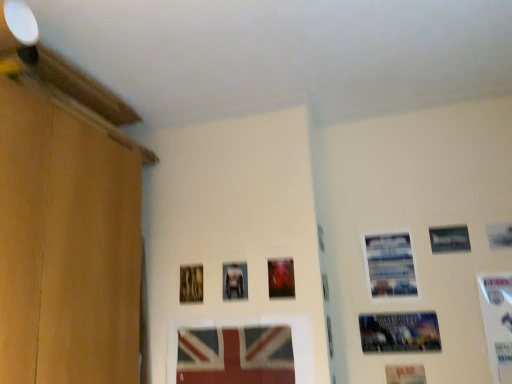
Question: Is metallic silver picture frame at upper right, the 3th picture frame in the right-to-left sequence, outside matte plastic picture frame at center, which is the 2th picture frame in left-to-right order?

Choices:
 (A) no
 (B) yes

Answer: (B)

Question: Considering the relative sizes of metallic silver picture frame at upper right, the 7th picture frame from the left, and matte plastic picture frame at center, which is the 2th picture frame in left-to-right order, in the image provided, is metallic silver picture frame at upper right, the 7th picture frame from the left, taller than matte plastic picture frame at center, which is the 2th picture frame in left-to-right order,?

Choices:
 (A) no
 (B) yes

Answer: (A)

Question: From a real-world perspective, is metallic silver picture frame at upper right, the 3th picture frame in the right-to-left sequence, below matte plastic picture frame at center, the 8th picture frame positioned from the right?

Choices:
 (A) yes
 (B) no

Answer: (B)

Question: From the image's perspective, is metallic silver picture frame at upper right, the 7th picture frame from the left, on top of matte plastic picture frame at center, which is the 2th picture frame in left-to-right order?

Choices:
 (A) yes
 (B) no

Answer: (A)

Question: Is metallic silver picture frame at upper right, the 3th picture frame in the right-to-left sequence, to the left of matte plastic picture frame at center, which is the 2th picture frame in left-to-right order, from the viewer's perspective?

Choices:
 (A) yes
 (B) no

Answer: (B)

Question: Is metallic silver picture frame at upper right, the 3th picture frame in the right-to-left sequence, looking in the opposite direction of matte plastic picture frame at center, the 8th picture frame positioned from the right?

Choices:
 (A) yes
 (B) no

Answer: (B)

Question: From a real-world perspective, is white glossy picture frame at right, the first picture frame positioned from the right, physically above wooden picture frame at center, the first picture frame in the left-to-right sequence?

Choices:
 (A) no
 (B) yes

Answer: (A)

Question: Does white glossy picture frame at right, the first picture frame positioned from the right, come behind wooden picture frame at center, the first picture frame in the left-to-right sequence?

Choices:
 (A) yes
 (B) no

Answer: (B)

Question: Is white glossy picture frame at right, which is counted as the ninth picture frame, starting from the left, looking in the opposite direction of wooden picture frame at center, positioned as the ninth picture frame in right-to-left order?

Choices:
 (A) no
 (B) yes

Answer: (A)

Question: Are white glossy picture frame at right, the first picture frame positioned from the right, and wooden picture frame at center, the first picture frame in the left-to-right sequence, located far from each other?

Choices:
 (A) no
 (B) yes

Answer: (B)

Question: Can you confirm if white glossy picture frame at right, which is counted as the ninth picture frame, starting from the left, is positioned to the right of wooden picture frame at center, positioned as the ninth picture frame in right-to-left order?

Choices:
 (A) no
 (B) yes

Answer: (B)

Question: From the image's perspective, is white glossy picture frame at right, the first picture frame positioned from the right, on wooden picture frame at center, the first picture frame in the left-to-right sequence?

Choices:
 (A) no
 (B) yes

Answer: (A)

Question: Is matte plastic picture frame at center, the 8th picture frame positioned from the right, to the left of metallic silver picture frame at center, the 7th picture frame from the right, from the viewer's perspective?

Choices:
 (A) no
 (B) yes

Answer: (B)